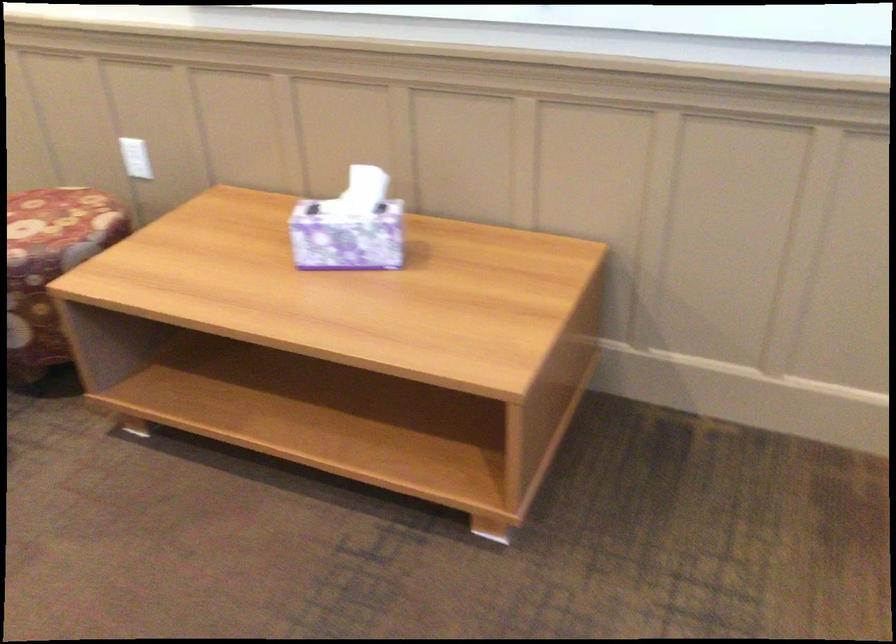
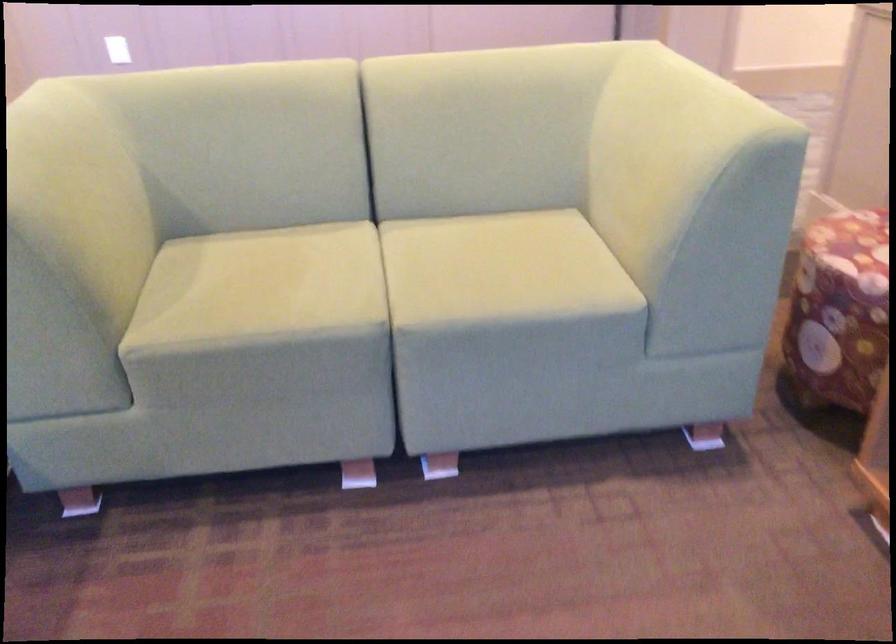
Question: How did the camera likely rotate?

Choices:
 (A) Left
 (B) Right
 (C) Up
 (D) Down

Answer: (A)